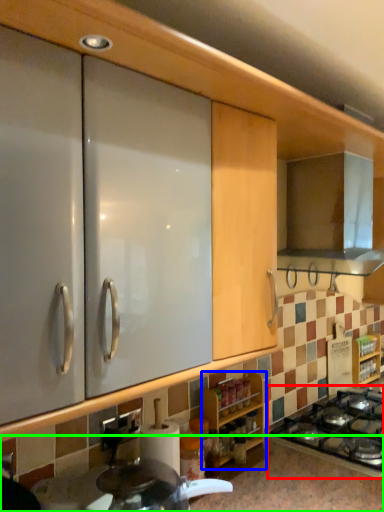
Question: Considering the real-world distances, which object is closest to gas stove (highlighted by a red box)? cabinetry (highlighted by a blue box) or countertop (highlighted by a green box).

Choices:
 (A) cabinetry
 (B) countertop

Answer: (B)